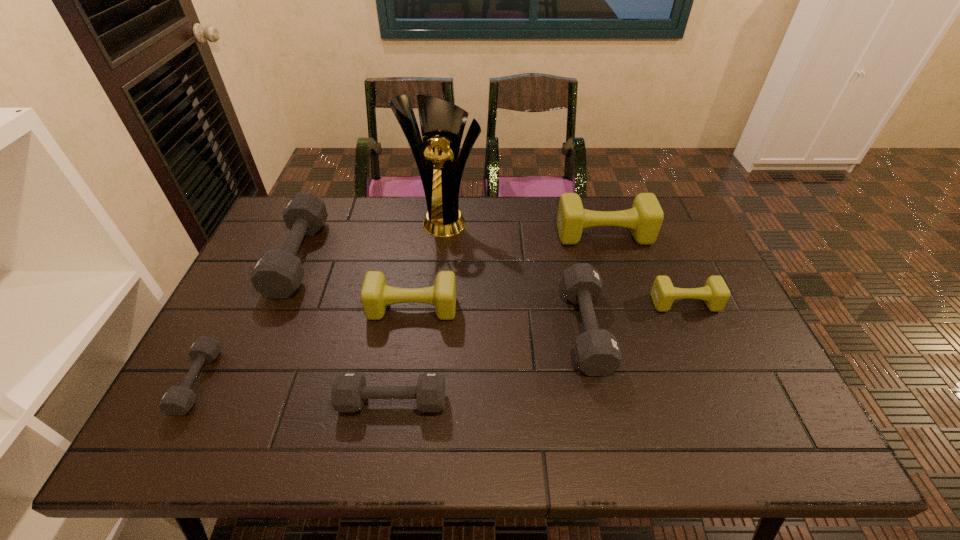
I want to click on free space between the shortest dumbbell and the second gray dumbbell from left to right, so click(248, 319).

Identify the location of free spot between the third smallest gray dumbbell and the second smallest gray dumbbell. (490, 364).

At what (x,y) coordinates should I click in order to perform the action: click on free space between the farthest olive dumbbell and the smallest gray dumbbell. Please return your answer as a coordinate pair (x, y). The width and height of the screenshot is (960, 540). Looking at the image, I should click on (400, 308).

Where is `vacant area that lies between the biggest gray dumbbell and the biggest olive dumbbell`? vacant area that lies between the biggest gray dumbbell and the biggest olive dumbbell is located at coordinates (451, 246).

What are the coordinates of `empty space between the smallest olive dumbbell and the leftmost olive dumbbell` in the screenshot? It's located at (548, 306).

The width and height of the screenshot is (960, 540). In order to click on vacant area between the sixth dumbbell from right to left and the smallest olive dumbbell in this screenshot , I will do `click(492, 280)`.

Identify the location of object that is the seventh closest to the biggest olive dumbbell. The image size is (960, 540). (177, 400).

This screenshot has height=540, width=960. What are the coordinates of `object that is the third nearest to the biggest olive dumbbell` in the screenshot? It's located at (442, 123).

Identify which dumbbell is the fourth nearest to the second biggest gray dumbbell. Please provide its 2D coordinates. Your answer should be formatted as a tuple, i.e. [(x, y)], where the tuple contains the x and y coordinates of a point satisfying the conditions above.

[(349, 391)]

Where is `dumbbell that stands as the sixth closest to the second biggest olive dumbbell`? Image resolution: width=960 pixels, height=540 pixels. dumbbell that stands as the sixth closest to the second biggest olive dumbbell is located at coordinates (715, 293).